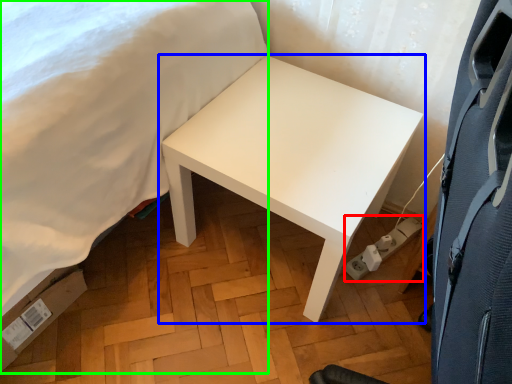
Question: Considering the real-world distances, which object is closest to electric outlet (highlighted by a red box)? table (highlighted by a blue box) or bed (highlighted by a green box).

Choices:
 (A) table
 (B) bed

Answer: (A)